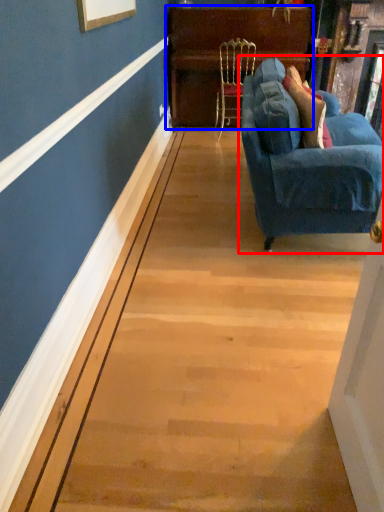
Question: Among these objects, which one is farthest to the camera, studio couch (highlighted by a red box) or dresser (highlighted by a blue box)?

Choices:
 (A) studio couch
 (B) dresser

Answer: (B)